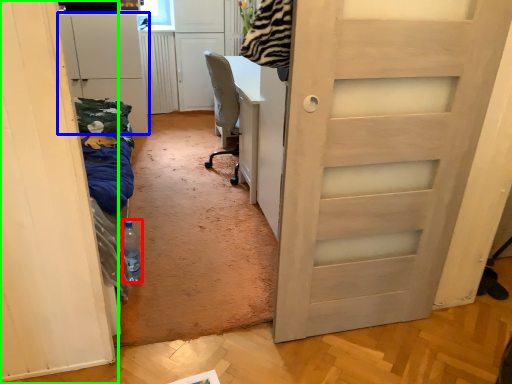
Question: Which object is positioned farthest from bottle (highlighted by a red box)? Select from cabinetry (highlighted by a blue box) and door (highlighted by a green box).

Choices:
 (A) cabinetry
 (B) door

Answer: (A)